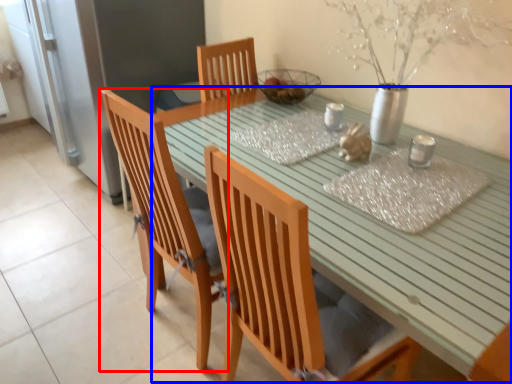
Question: Which of the following is the farthest to the observer, chair (highlighted by a red box) or table (highlighted by a blue box)?

Choices:
 (A) chair
 (B) table

Answer: (A)